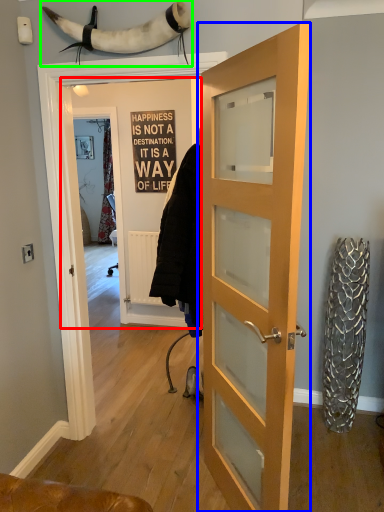
Question: Which object is positioned farthest from door (highlighted by a red box)? Select from door (highlighted by a blue box) and animal (highlighted by a green box).

Choices:
 (A) door
 (B) animal

Answer: (A)